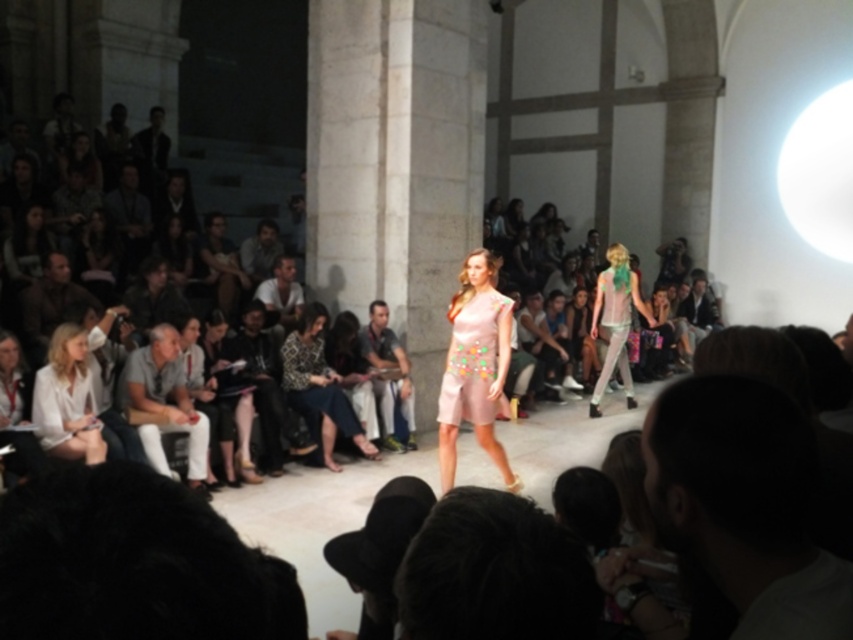
At what (x,y) coordinates should I click in order to perform the action: click on matte white blouse at lower left. Please return your answer as a coordinate pair (x, y). Looking at the image, I should click on (16, 412).

Who is shorter, matte white blouse at lower left or white cotton shirt at center?

white cotton shirt at center is shorter.

Between point (3, 442) and point (289, 317), which one is positioned behind?

The point (289, 317) is behind.

At what (x,y) coordinates should I click in order to perform the action: click on matte white blouse at lower left. Please return your answer as a coordinate pair (x, y). This screenshot has width=853, height=640. Looking at the image, I should click on (16, 412).

Is point (62, 392) positioned after point (16, 390)?

Yes, it is.

Can you confirm if white matte jacket at lower left is shorter than matte white blouse at lower left?

No, white matte jacket at lower left is not shorter than matte white blouse at lower left.

Identify the location of white matte jacket at lower left. Image resolution: width=853 pixels, height=640 pixels. tap(67, 397).

Which of these two, white matte jacket at lower left or pale pink satin dress at center, stands shorter?

pale pink satin dress at center

Which is behind, point (76, 454) or point (467, 419)?

Positioned behind is point (467, 419).

Find the location of a particular element. The image size is (853, 640). white matte jacket at lower left is located at coordinates (67, 397).